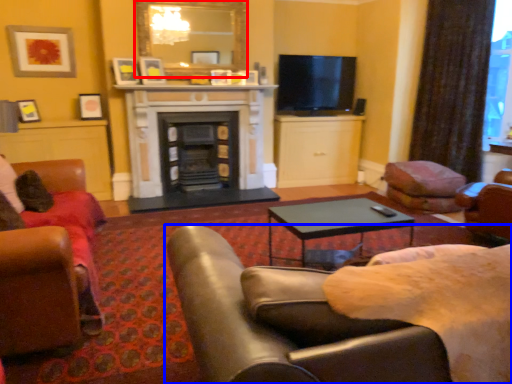
Question: Which object appears closest to the camera in this image, mirror (highlighted by a red box) or chair (highlighted by a blue box)?

Choices:
 (A) mirror
 (B) chair

Answer: (B)